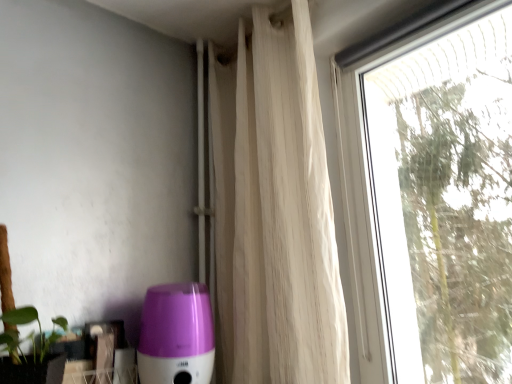
Question: Considering the relative sizes of purple glossy humidifier at lower left and transparent glass window at right in the image provided, is purple glossy humidifier at lower left shorter than transparent glass window at right?

Choices:
 (A) no
 (B) yes

Answer: (B)

Question: Can you confirm if purple glossy humidifier at lower left is thinner than transparent glass window at right?

Choices:
 (A) no
 (B) yes

Answer: (A)

Question: Considering the relative sizes of purple glossy humidifier at lower left and transparent glass window at right in the image provided, is purple glossy humidifier at lower left taller than transparent glass window at right?

Choices:
 (A) no
 (B) yes

Answer: (A)

Question: Is purple glossy humidifier at lower left to the left of transparent glass window at right from the viewer's perspective?

Choices:
 (A) yes
 (B) no

Answer: (A)

Question: From a real-world perspective, is purple glossy humidifier at lower left below transparent glass window at right?

Choices:
 (A) no
 (B) yes

Answer: (B)

Question: Considering the relative positions of purple glossy humidifier at lower left and transparent glass window at right in the image provided, is purple glossy humidifier at lower left to the right of transparent glass window at right from the viewer's perspective?

Choices:
 (A) no
 (B) yes

Answer: (A)

Question: Is transparent glass window at right looking in the opposite direction of white sheer curtain at upper right?

Choices:
 (A) yes
 (B) no

Answer: (B)

Question: Is transparent glass window at right taller than white sheer curtain at upper right?

Choices:
 (A) no
 (B) yes

Answer: (A)

Question: Does transparent glass window at right lie in front of white sheer curtain at upper right?

Choices:
 (A) no
 (B) yes

Answer: (B)

Question: Is transparent glass window at right touching white sheer curtain at upper right?

Choices:
 (A) yes
 (B) no

Answer: (B)

Question: Can you confirm if transparent glass window at right is positioned to the left of white sheer curtain at upper right?

Choices:
 (A) no
 (B) yes

Answer: (A)

Question: Does transparent glass window at right have a lesser height compared to white sheer curtain at upper right?

Choices:
 (A) no
 (B) yes

Answer: (B)

Question: From the image's perspective, is white sheer curtain at upper right located above transparent glass window at right?

Choices:
 (A) yes
 (B) no

Answer: (A)